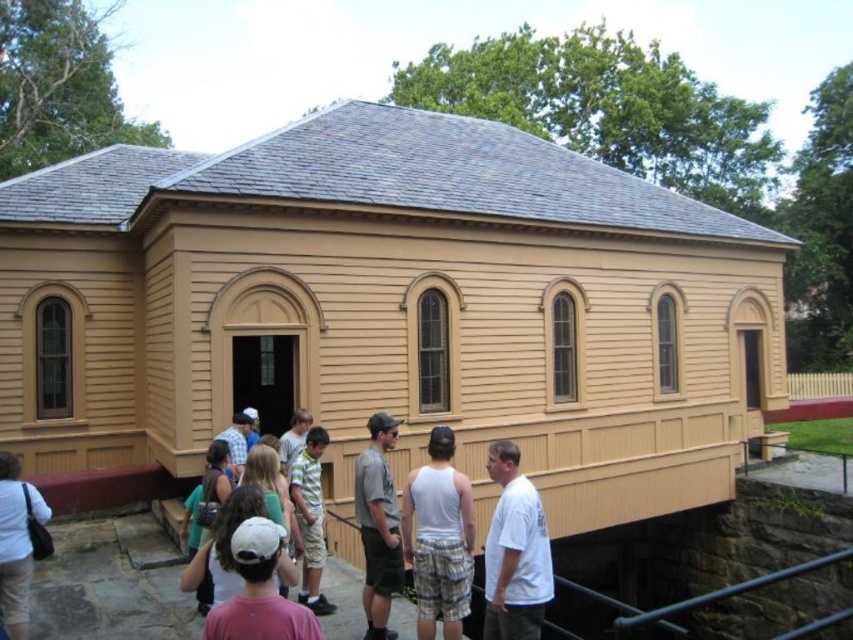
Question: Estimate the real-world distances between objects in this image. Which object is closer to the pink cotton shirt at lower center?

Choices:
 (A) white cotton cap at center
 (B) white cotton shirt at lower left
 (C) white cotton shirt at center

Answer: (A)

Question: Does pink cotton shirt at lower center have a lesser width compared to white cotton shirt at lower left?

Choices:
 (A) no
 (B) yes

Answer: (A)

Question: Which object is closer to the camera taking this photo?

Choices:
 (A) white cotton cap at center
 (B) gray fabric shirt at center

Answer: (A)

Question: Is gray fabric shirt at center bigger than white cotton cap at center?

Choices:
 (A) yes
 (B) no

Answer: (A)

Question: Among these points, which one is farthest from the camera?

Choices:
 (A) (274, 474)
 (B) (252, 508)
 (C) (300, 595)

Answer: (C)

Question: Is white cap at center bigger than white cotton cap at center?

Choices:
 (A) no
 (B) yes

Answer: (A)